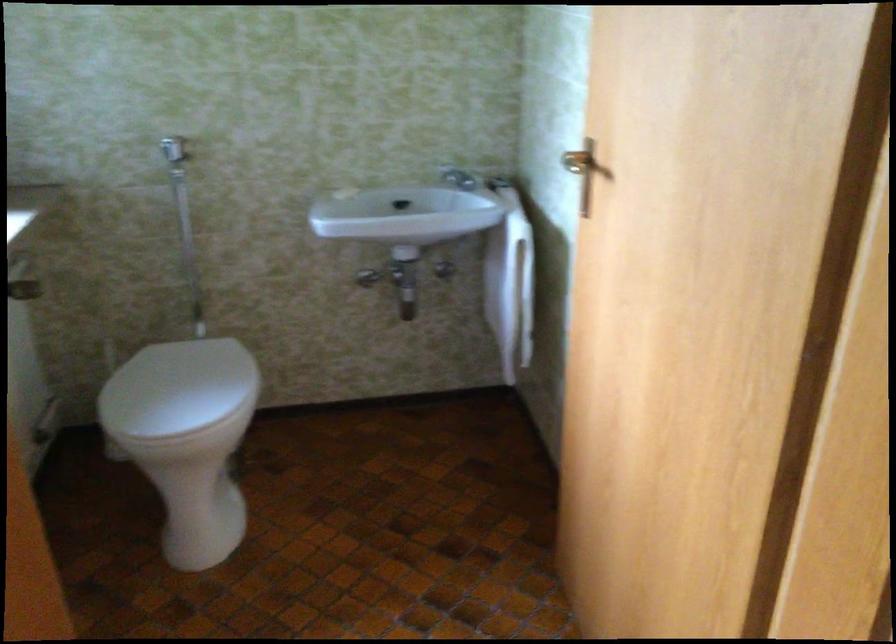
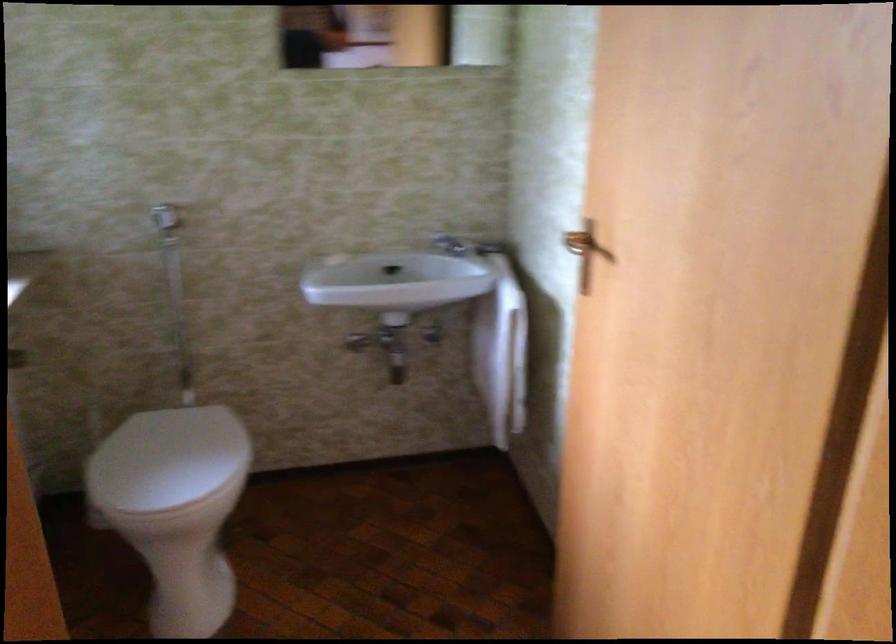
Locate, in the second image, the point that corresponds to pixel 177 388 in the first image.

(167, 460)